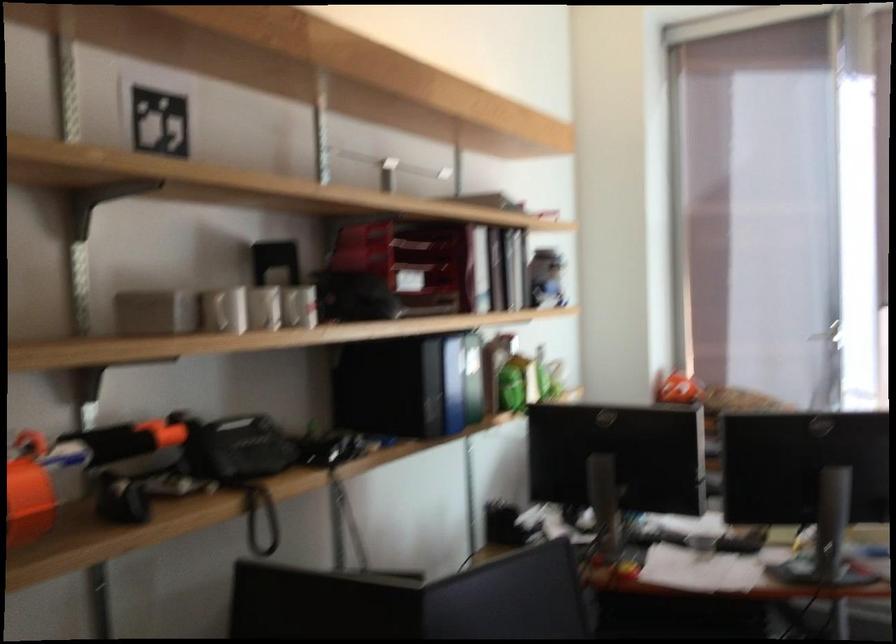
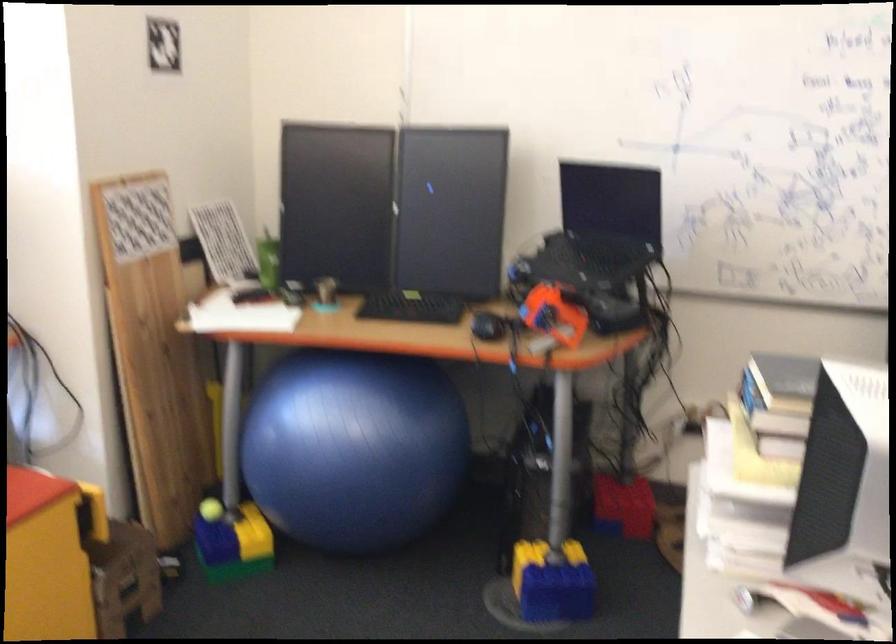
First-person continuous shooting, in which direction is the camera rotating?

The rotation direction of the camera is right-down.